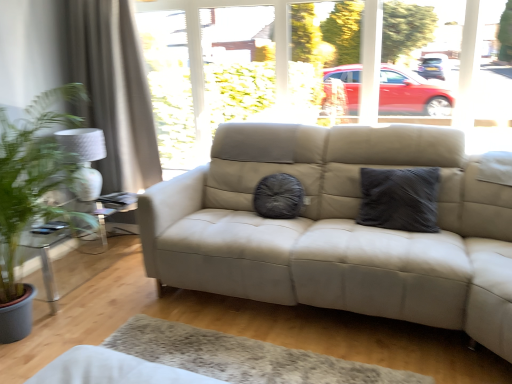
Question: Does white textured curtain at left lie behind dark grey textured pillow at center?

Choices:
 (A) yes
 (B) no

Answer: (A)

Question: Is white textured curtain at left wider than dark grey textured pillow at center?

Choices:
 (A) yes
 (B) no

Answer: (A)

Question: From the image's perspective, does white textured curtain at left appear higher than dark grey textured pillow at center?

Choices:
 (A) yes
 (B) no

Answer: (A)

Question: Considering the relative sizes of white textured curtain at left and dark grey textured pillow at center in the image provided, is white textured curtain at left shorter than dark grey textured pillow at center?

Choices:
 (A) no
 (B) yes

Answer: (A)

Question: Considering the relative positions of white textured curtain at left and dark grey textured pillow at center in the image provided, is white textured curtain at left in front of dark grey textured pillow at center?

Choices:
 (A) no
 (B) yes

Answer: (A)

Question: From a real-world perspective, is clear glass table at left physically located above or below transparent glass window at center?

Choices:
 (A) above
 (B) below

Answer: (B)

Question: From the image's perspective, relative to transparent glass window at center, is clear glass table at left above or below?

Choices:
 (A) above
 (B) below

Answer: (B)

Question: Is clear glass table at left taller or shorter than transparent glass window at center?

Choices:
 (A) tall
 (B) short

Answer: (B)

Question: Looking at the image, does clear glass table at left seem bigger or smaller compared to transparent glass window at center?

Choices:
 (A) big
 (B) small

Answer: (B)

Question: Looking at the image, does white textured curtain at left seem bigger or smaller compared to dark grey textured pillow at center?

Choices:
 (A) small
 (B) big

Answer: (B)

Question: From the image's perspective, relative to dark grey textured pillow at center, is white textured curtain at left above or below?

Choices:
 (A) above
 (B) below

Answer: (A)

Question: Is white textured curtain at left inside the boundaries of dark grey textured pillow at center, or outside?

Choices:
 (A) outside
 (B) inside

Answer: (A)

Question: Considering the positions of white textured curtain at left and dark grey textured pillow at center in the image, is white textured curtain at left wider or thinner than dark grey textured pillow at center?

Choices:
 (A) wide
 (B) thin

Answer: (A)

Question: In the image, is clear glass table at left on the left side or the right side of white textured curtain at left?

Choices:
 (A) left
 (B) right

Answer: (A)

Question: From the image's perspective, is clear glass table at left above or below white textured curtain at left?

Choices:
 (A) below
 (B) above

Answer: (A)